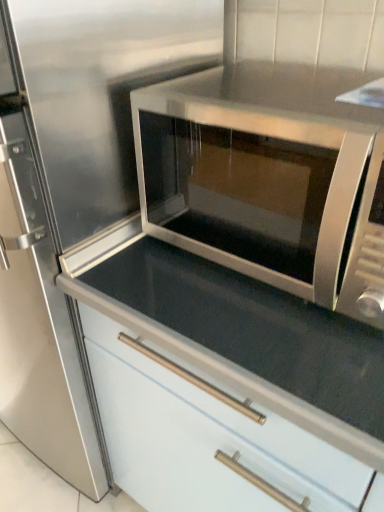
Question: From a real-world perspective, is white glossy cabinet at center on stainless steel microwave at center?

Choices:
 (A) no
 (B) yes

Answer: (A)

Question: Is white glossy cabinet at center to the right of stainless steel microwave at center from the viewer's perspective?

Choices:
 (A) no
 (B) yes

Answer: (A)

Question: Considering the relative sizes of white glossy cabinet at center and stainless steel microwave at center in the image provided, is white glossy cabinet at center shorter than stainless steel microwave at center?

Choices:
 (A) no
 (B) yes

Answer: (A)

Question: Is white glossy cabinet at center thinner than stainless steel microwave at center?

Choices:
 (A) yes
 (B) no

Answer: (B)

Question: From a real-world perspective, does white glossy cabinet at center sit lower than stainless steel microwave at center?

Choices:
 (A) no
 (B) yes

Answer: (B)

Question: Does white glossy cabinet at center turn towards stainless steel microwave at center?

Choices:
 (A) yes
 (B) no

Answer: (B)

Question: Is stainless steel microwave at center bigger than white glossy cabinet at center?

Choices:
 (A) yes
 (B) no

Answer: (B)

Question: Does stainless steel microwave at center touch white glossy cabinet at center?

Choices:
 (A) yes
 (B) no

Answer: (B)

Question: Can we say stainless steel microwave at center lies outside white glossy cabinet at center?

Choices:
 (A) no
 (B) yes

Answer: (B)

Question: From a real-world perspective, is stainless steel microwave at center on top of white glossy cabinet at center?

Choices:
 (A) no
 (B) yes

Answer: (B)

Question: From the image's perspective, would you say stainless steel microwave at center is positioned over white glossy cabinet at center?

Choices:
 (A) no
 (B) yes

Answer: (B)

Question: Is stainless steel microwave at center thinner than white glossy cabinet at center?

Choices:
 (A) no
 (B) yes

Answer: (B)

Question: Looking at their shapes, would you say stainless steel microwave at center is wider or thinner than white glossy cabinet at center?

Choices:
 (A) wide
 (B) thin

Answer: (B)